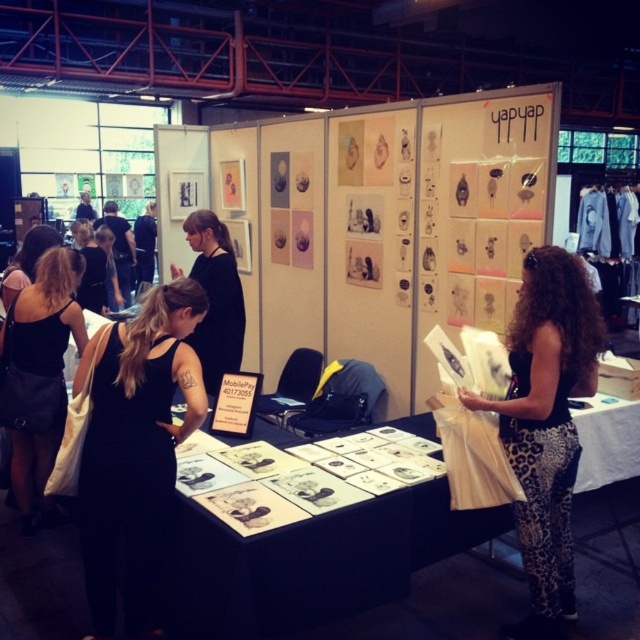
Is leopard print pants at center to the right of black leather dress at left from the viewer's perspective?

Correct, you'll find leopard print pants at center to the right of black leather dress at left.

Is point (560, 269) closer to camera compared to point (40, 326)?

That is True.

The image size is (640, 640). What do you see at coordinates (547, 426) in the screenshot? I see `leopard print pants at center` at bounding box center [547, 426].

This screenshot has height=640, width=640. What are the coordinates of `leopard print pants at center` in the screenshot? It's located at (547, 426).

Between black matte dress at center and black leather dress at left, which one has more height?

Standing taller between the two is black leather dress at left.

Does black matte dress at center appear on the right side of black leather dress at left?

Correct, you'll find black matte dress at center to the right of black leather dress at left.

Is point (129, 396) less distant than point (26, 500)?

Yes, point (129, 396) is closer to viewer.

Locate an element on the screen. black matte dress at center is located at coordinates (134, 452).

Between white paper at center and black matte dress at center, which one is positioned lower?

white paper at center is below.

Is the position of white paper at center less distant than that of black matte dress at center?

That is True.

Is point (506, 616) less distant than point (144, 392)?

That is False.

Locate an element on the screen. The image size is (640, 640). white paper at center is located at coordinates (314, 563).